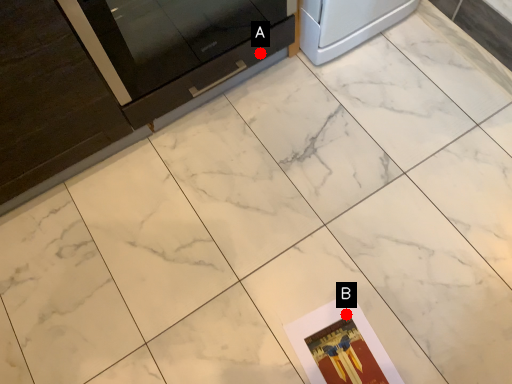
Question: Two points are circled on the image, labeled by A and B beside each circle. Which point is closer to the camera?

Choices:
 (A) A is closer
 (B) B is closer

Answer: (B)